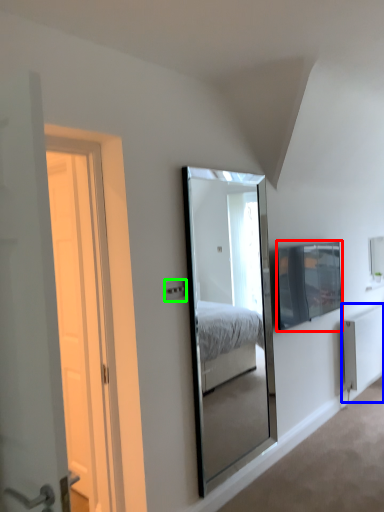
Question: Considering the real-world distances, which object is farthest from television (highlighted by a red box)? radiator (highlighted by a blue box) or electric outlet (highlighted by a green box)?

Choices:
 (A) radiator
 (B) electric outlet

Answer: (B)